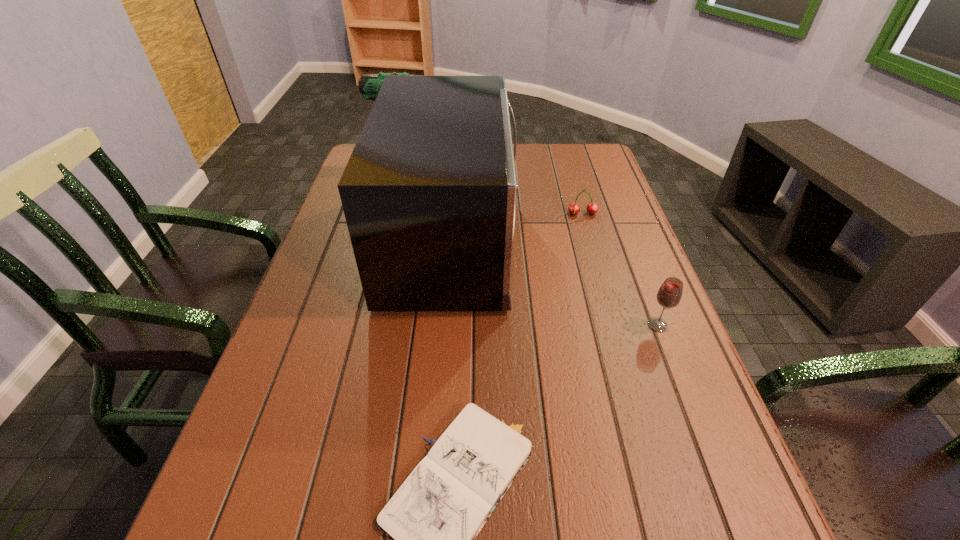
Where is `vacant space located 0.070m with stems pointing upwards on the second object from right to left`? The width and height of the screenshot is (960, 540). vacant space located 0.070m with stems pointing upwards on the second object from right to left is located at coordinates (588, 233).

Identify the location of object located at the far edge. This screenshot has width=960, height=540. (369, 85).

Find the location of `object at the left edge`. object at the left edge is located at coordinates (369, 85).

This screenshot has height=540, width=960. Identify the location of glass drink container positioned at the right edge. (669, 295).

I want to click on cherry at the right edge, so click(x=574, y=208).

At what (x,y) coordinates should I click in order to perform the action: click on object located at the far left corner. Please return your answer as a coordinate pair (x, y). The image size is (960, 540). Looking at the image, I should click on (369, 85).

Identify the location of free space at the left edge. This screenshot has height=540, width=960. (309, 529).

This screenshot has height=540, width=960. Find the location of `vacant space at the right edge`. vacant space at the right edge is located at coordinates (683, 518).

Where is `free space between the second object from right to left and the glass drink container`? Image resolution: width=960 pixels, height=540 pixels. free space between the second object from right to left and the glass drink container is located at coordinates (620, 269).

You are a GUI agent. You are given a task and a screenshot of the screen. Output one action in this format:
    pyautogui.click(x=<x>, y=<y>)
    Task: Click on the free space between the microwave oven and the glass drink container
    
    Given the screenshot: What is the action you would take?
    pyautogui.click(x=555, y=282)